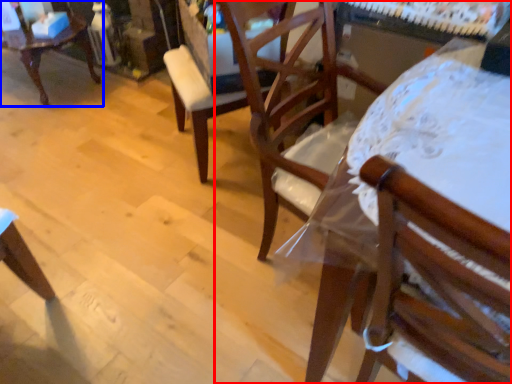
Question: Which point is further to the camera, chair (highlighted by a red box) or chair (highlighted by a blue box)?

Choices:
 (A) chair
 (B) chair

Answer: (B)